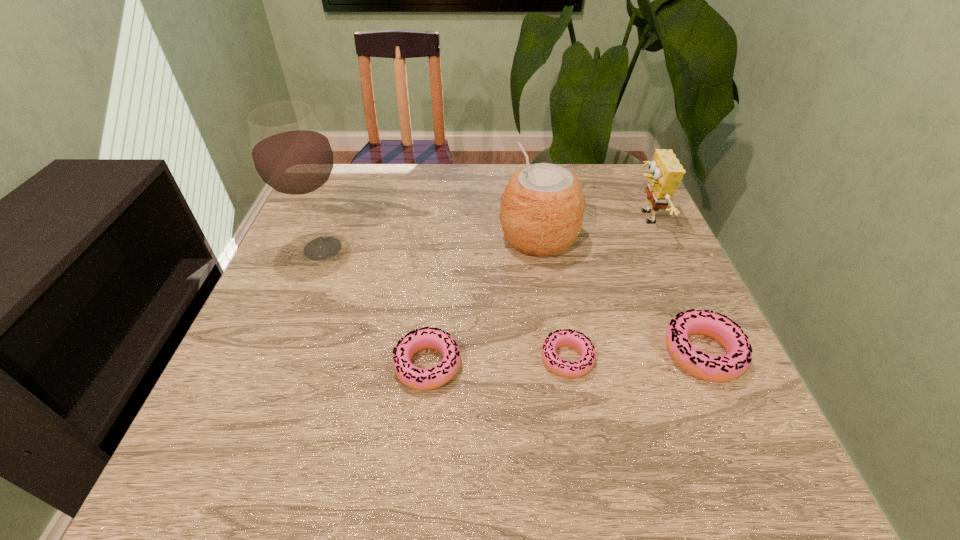
Locate an element on the screen. This screenshot has width=960, height=540. vacant space at the far right corner of the desktop is located at coordinates pos(598,208).

You are a GUI agent. You are given a task and a screenshot of the screen. Output one action in this format:
    pyautogui.click(x=<x>, y=<y>)
    Task: Click on the vacant area between the second doughnut from left to right and the fourth shortest object
    The image size is (960, 540).
    Given the screenshot: What is the action you would take?
    pyautogui.click(x=606, y=288)

What are the coordinates of `empty location between the second object from left to right and the tallest object` in the screenshot? It's located at (375, 307).

Identify the location of free point between the sponge and the third shortest object. (674, 285).

Where is `vacant area between the leftmost doughnut and the alcohol`? Image resolution: width=960 pixels, height=540 pixels. vacant area between the leftmost doughnut and the alcohol is located at coordinates (375, 307).

Locate an element on the screen. This screenshot has width=960, height=540. vacant point located between the rightmost doughnut and the coconut is located at coordinates (621, 295).

Where is `empty space between the fourth shortest object and the fifth shortest object`? This screenshot has height=540, width=960. empty space between the fourth shortest object and the fifth shortest object is located at coordinates (592, 228).

You are a GUI agent. You are given a task and a screenshot of the screen. Output one action in this format:
    pyautogui.click(x=<x>, y=<y>)
    Task: Click on the vacant space in between the alcohol and the second tallest doughnut
    The width and height of the screenshot is (960, 540).
    Given the screenshot: What is the action you would take?
    pyautogui.click(x=375, y=307)

Where is `free space between the third shortest object and the sponge`? free space between the third shortest object and the sponge is located at coordinates (674, 285).

You are a GUI agent. You are given a task and a screenshot of the screen. Output one action in this format:
    pyautogui.click(x=<x>, y=<y>)
    Task: Click on the unoccupied area between the second tallest object and the second shortest doughnut
    The image size is (960, 540).
    Given the screenshot: What is the action you would take?
    pyautogui.click(x=483, y=302)